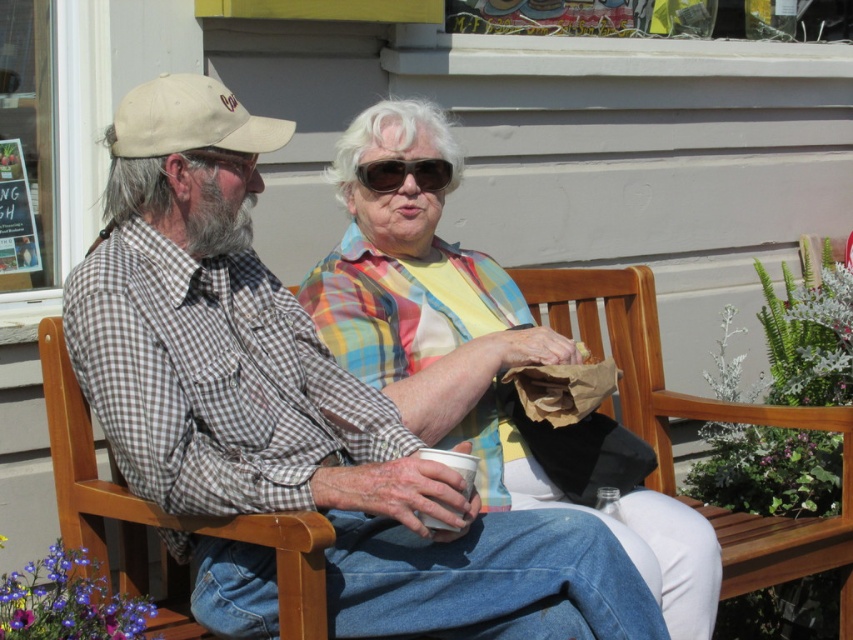
Question: Is beige fabric cap at left to the left of black plastic sunglasses at center from the viewer's perspective?

Choices:
 (A) no
 (B) yes

Answer: (B)

Question: Which of the following is the farthest from the observer?

Choices:
 (A) tap(444, 164)
 (B) tap(416, 413)

Answer: (A)

Question: Which point appears farthest from the camera in this image?

Choices:
 (A) pos(490,310)
 (B) pos(440,164)

Answer: (A)

Question: Does plaid shirt at center have a greater width compared to wooden bench at center?

Choices:
 (A) yes
 (B) no

Answer: (A)

Question: Which of these objects is positioned closest to the beige fabric cap at left?

Choices:
 (A) plaid shirt at center
 (B) black plastic sunglasses at center
 (C) wooden bench at center

Answer: (B)

Question: Can you confirm if wooden bench at center is thinner than black plastic sunglasses at center?

Choices:
 (A) yes
 (B) no

Answer: (B)